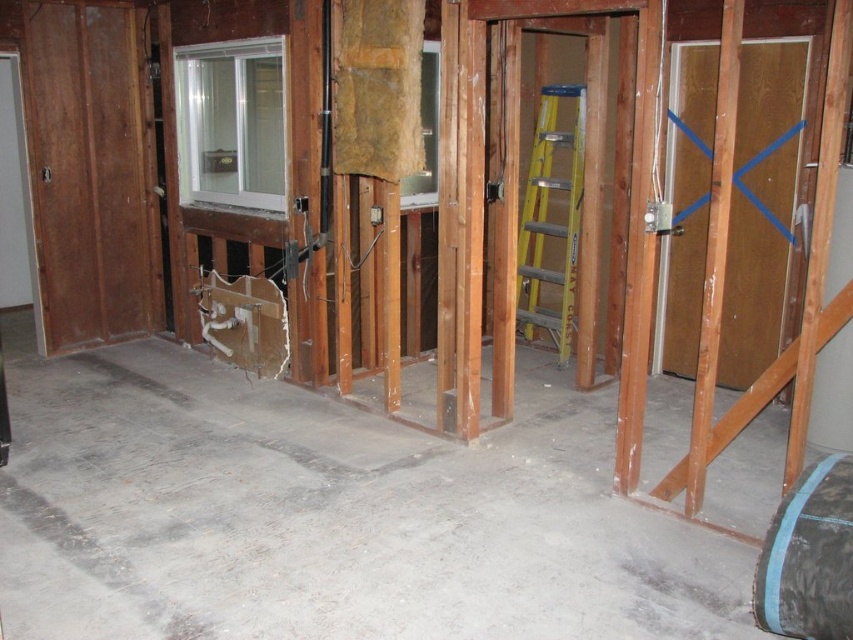
Question: Which of the following is the farthest from the observer?

Choices:
 (A) gray concrete floor at lower left
 (B) yellow/yellowish metallic ladder at center-right

Answer: (B)

Question: Where is gray concrete floor at lower left located in relation to yellow/yellowish metallic ladder at center-right in the image?

Choices:
 (A) left
 (B) right

Answer: (A)

Question: Which of the following is the closest to the observer?

Choices:
 (A) (593, 593)
 (B) (560, 145)

Answer: (A)

Question: Is gray concrete floor at lower left in front of yellow/yellowish metallic ladder at center-right?

Choices:
 (A) yes
 (B) no

Answer: (A)

Question: Does gray concrete floor at lower left have a smaller size compared to yellow/yellowish metallic ladder at center-right?

Choices:
 (A) no
 (B) yes

Answer: (A)